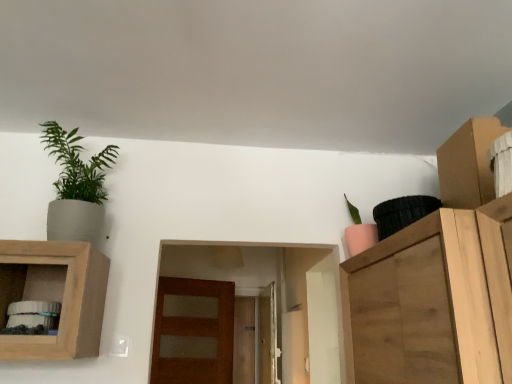
Question: Is brown cardboard cabinet at upper right facing away from wooden cabinet at left?

Choices:
 (A) no
 (B) yes

Answer: (A)

Question: Could you tell me if brown cardboard cabinet at upper right is turned towards wooden cabinet at left?

Choices:
 (A) yes
 (B) no

Answer: (A)

Question: Considering the relative positions of brown cardboard cabinet at upper right and wooden cabinet at left in the image provided, is brown cardboard cabinet at upper right in front of wooden cabinet at left?

Choices:
 (A) no
 (B) yes

Answer: (B)

Question: From a real-world perspective, is brown cardboard cabinet at upper right positioned under wooden cabinet at left based on gravity?

Choices:
 (A) no
 (B) yes

Answer: (A)

Question: Would you say wooden cabinet at left is part of brown cardboard cabinet at upper right's contents?

Choices:
 (A) yes
 (B) no

Answer: (B)

Question: From a real-world perspective, is brown cardboard cabinet at upper right on top of wooden cabinet at left?

Choices:
 (A) no
 (B) yes

Answer: (B)

Question: From a real-world perspective, does wooden cabinet at left sit lower than pink matte pot at upper right, positioned as the second houseplant in left-to-right order?

Choices:
 (A) no
 (B) yes

Answer: (B)

Question: Is wooden cabinet at left positioned before pink matte pot at upper right, the first houseplant in the right-to-left sequence?

Choices:
 (A) no
 (B) yes

Answer: (B)

Question: Is wooden cabinet at left turned away from pink matte pot at upper right, positioned as the second houseplant in left-to-right order?

Choices:
 (A) yes
 (B) no

Answer: (B)

Question: Is wooden cabinet at left next to pink matte pot at upper right, positioned as the second houseplant in left-to-right order, and touching it?

Choices:
 (A) yes
 (B) no

Answer: (B)

Question: Is wooden cabinet at left positioned far away from pink matte pot at upper right, positioned as the second houseplant in left-to-right order?

Choices:
 (A) no
 (B) yes

Answer: (B)

Question: Considering the relative positions of wooden cabinet at left and pink matte pot at upper right, the first houseplant in the right-to-left sequence, in the image provided, is wooden cabinet at left to the left of pink matte pot at upper right, the first houseplant in the right-to-left sequence, from the viewer's perspective?

Choices:
 (A) no
 (B) yes

Answer: (B)

Question: Can you confirm if brown matte door at center is wider than brown cardboard cabinet at upper right?

Choices:
 (A) yes
 (B) no

Answer: (B)